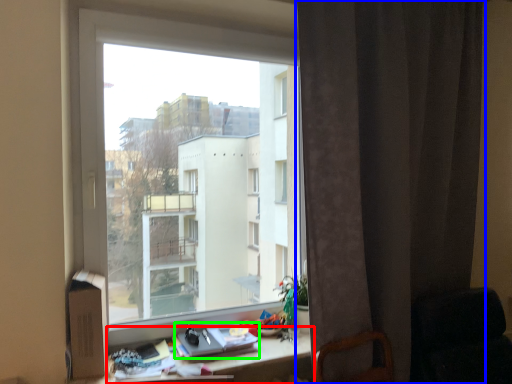
Question: Based on their relative distances, which object is farther from desk (highlighted by a red box)? Choose from curtain (highlighted by a blue box) and book (highlighted by a green box).

Choices:
 (A) curtain
 (B) book

Answer: (A)